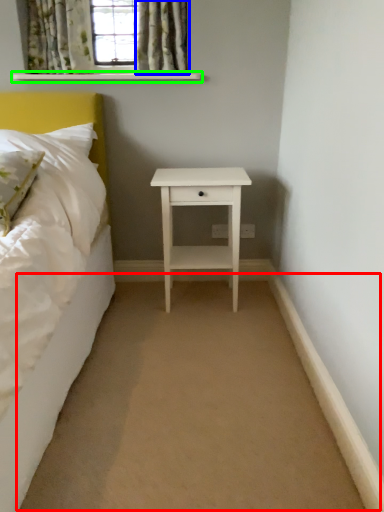
Question: Which object is positioned farthest from plain (highlighted by a red box)? Select from curtain (highlighted by a blue box) and window sill (highlighted by a green box).

Choices:
 (A) curtain
 (B) window sill

Answer: (B)